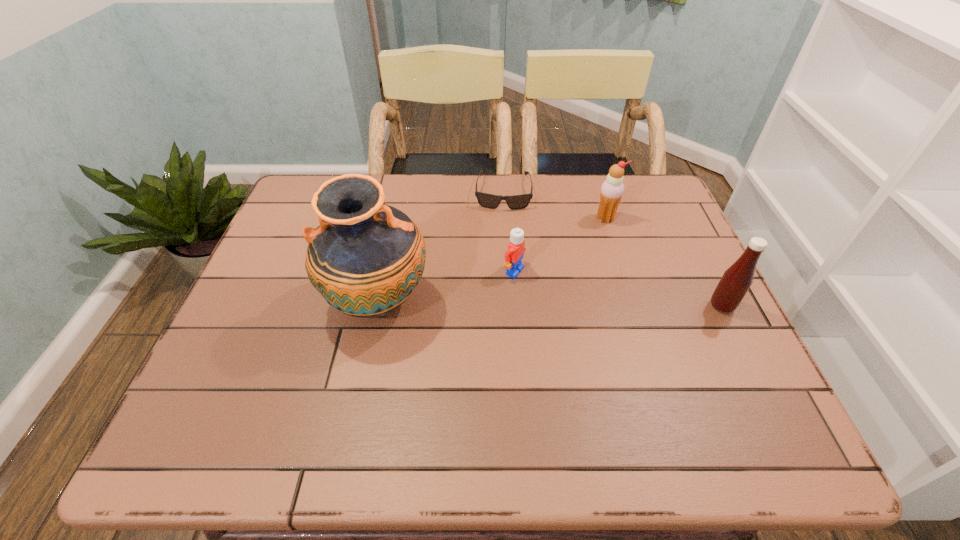
What are the coordinates of `blank area in the image that satisfies the following two spatial constraints: 1. on the back side of the pottery; 2. on the right side of the icecream` in the screenshot? It's located at (396, 218).